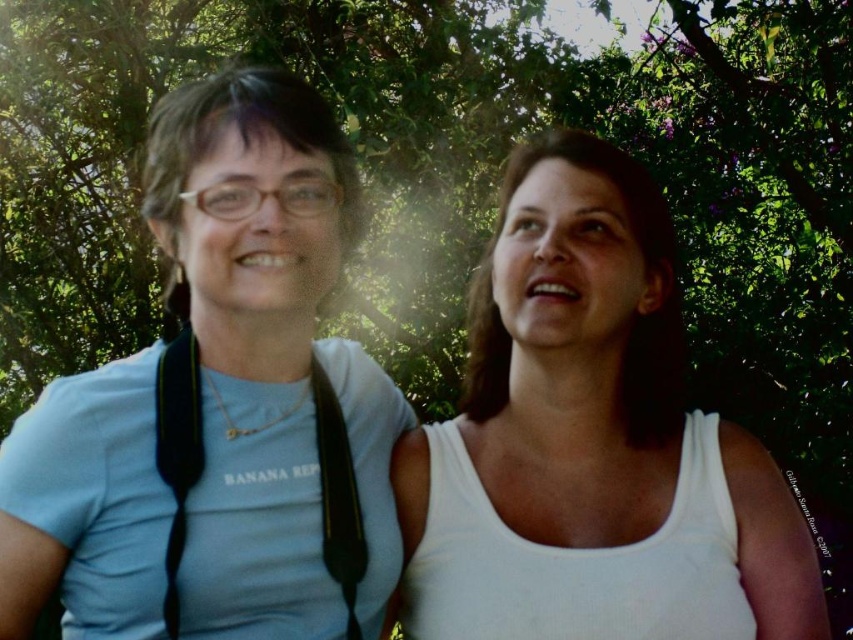
Question: Does light blue t-shirt at left appear on the right side of white matte tank top at center?

Choices:
 (A) no
 (B) yes

Answer: (A)

Question: Which of the following is the farthest from the observer?

Choices:
 (A) (242, 273)
 (B) (178, 490)
 (C) (750, 570)

Answer: (C)

Question: Can you confirm if light blue t-shirt at left is bigger than light blue fabric vest at left?

Choices:
 (A) yes
 (B) no

Answer: (A)

Question: Is light blue t-shirt at left bigger than light blue fabric vest at left?

Choices:
 (A) no
 (B) yes

Answer: (B)

Question: Which point appears farthest from the camera in this image?

Choices:
 (A) pos(473,348)
 (B) pos(173,458)
 (C) pos(230,269)

Answer: (A)

Question: Which point is closer to the camera taking this photo?

Choices:
 (A) (32, 586)
 (B) (548, 339)
 (C) (177, 496)

Answer: (A)